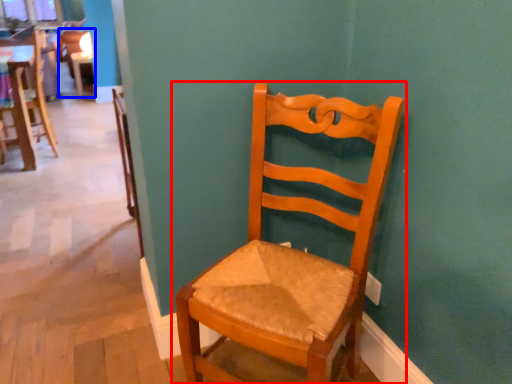
Question: Which object appears closest to the camera in this image, chair (highlighted by a red box) or chair (highlighted by a blue box)?

Choices:
 (A) chair
 (B) chair

Answer: (A)